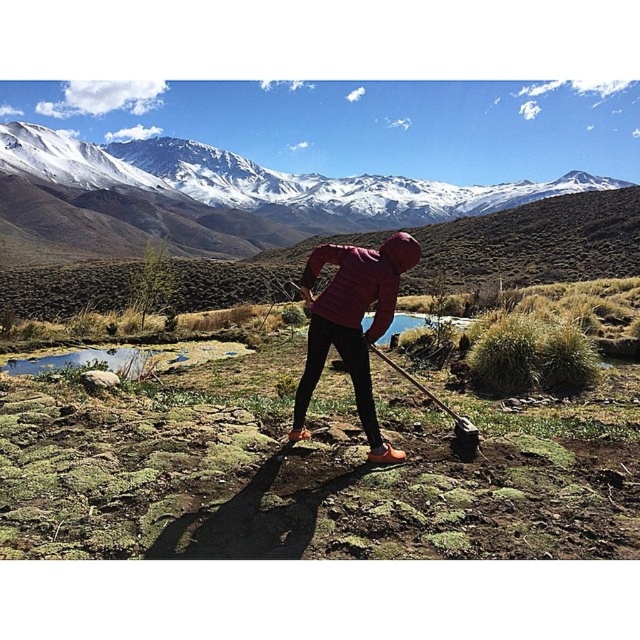
Is snowy white mountain at upper center shorter than wooden shovel at center?

No.

Is snowy white mountain at upper center behind wooden shovel at center?

Yes, it is.

At what (x,y) coordinates should I click in order to perform the action: click on snowy white mountain at upper center. Please return your answer as a coordinate pair (x, y). The width and height of the screenshot is (640, 640). Looking at the image, I should click on (252, 188).

Find the location of a particular element. The height and width of the screenshot is (640, 640). snowy white mountain at upper center is located at coordinates [252, 188].

Between snowy white mountain at upper center and matte pink jacket at center, which one has less height?

matte pink jacket at center is shorter.

Consider the image. Can you confirm if snowy white mountain at upper center is positioned above matte pink jacket at center?

Correct, snowy white mountain at upper center is located above matte pink jacket at center.

Measure the distance between snowy white mountain at upper center and camera.

They are 222.96 feet apart.

Locate an element on the screen. This screenshot has width=640, height=640. snowy white mountain at upper center is located at coordinates (252, 188).

This screenshot has width=640, height=640. Describe the element at coordinates (352, 324) in the screenshot. I see `matte pink jacket at center` at that location.

Which of these two, matte pink jacket at center or wooden shovel at center, stands shorter?

matte pink jacket at center is shorter.

Does point (355, 378) come farther from viewer compared to point (456, 435)?

That is False.

What are the coordinates of `matte pink jacket at center` in the screenshot? It's located at click(x=352, y=324).